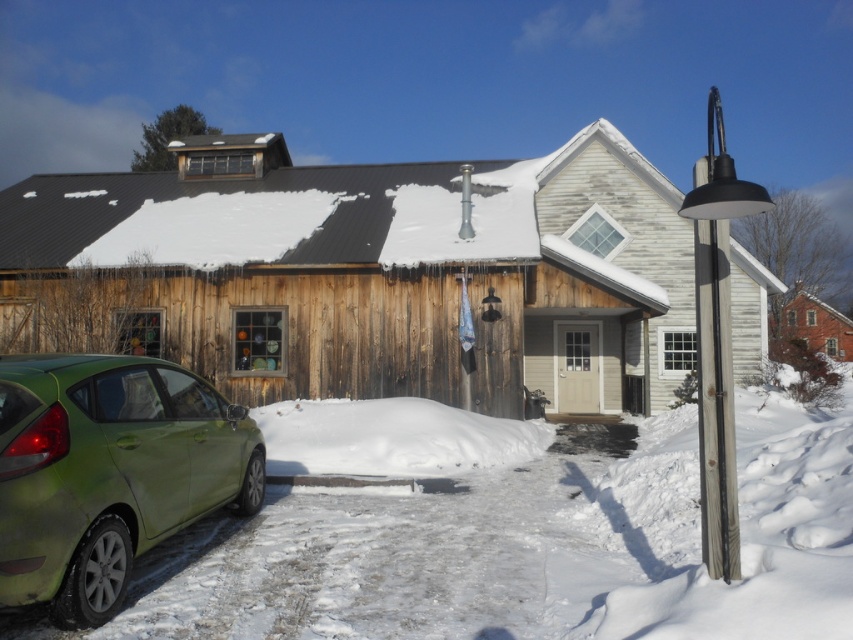
Question: Among these objects, which one is nearest to the camera?

Choices:
 (A) green matte car at lower left
 (B) white fluffy snow at lower center

Answer: (A)

Question: In this image, where is green matte car at lower left located relative to white fluffy snow at lower center?

Choices:
 (A) below
 (B) above

Answer: (B)

Question: Does green matte car at lower left appear on the left side of white fluffy snow at lower center?

Choices:
 (A) yes
 (B) no

Answer: (A)

Question: Is green matte car at lower left to the left of white fluffy snow at lower center from the viewer's perspective?

Choices:
 (A) no
 (B) yes

Answer: (B)